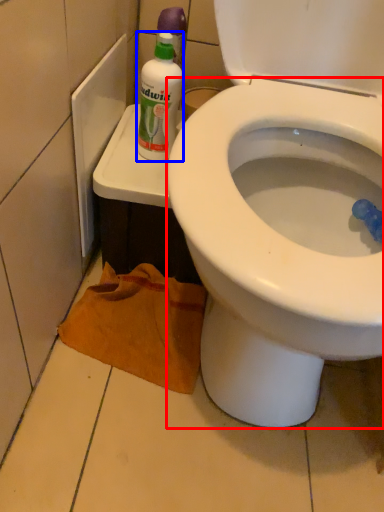
Question: Among these objects, which one is farthest to the camera, bidet (highlighted by a red box) or cleaning product (highlighted by a blue box)?

Choices:
 (A) bidet
 (B) cleaning product

Answer: (B)